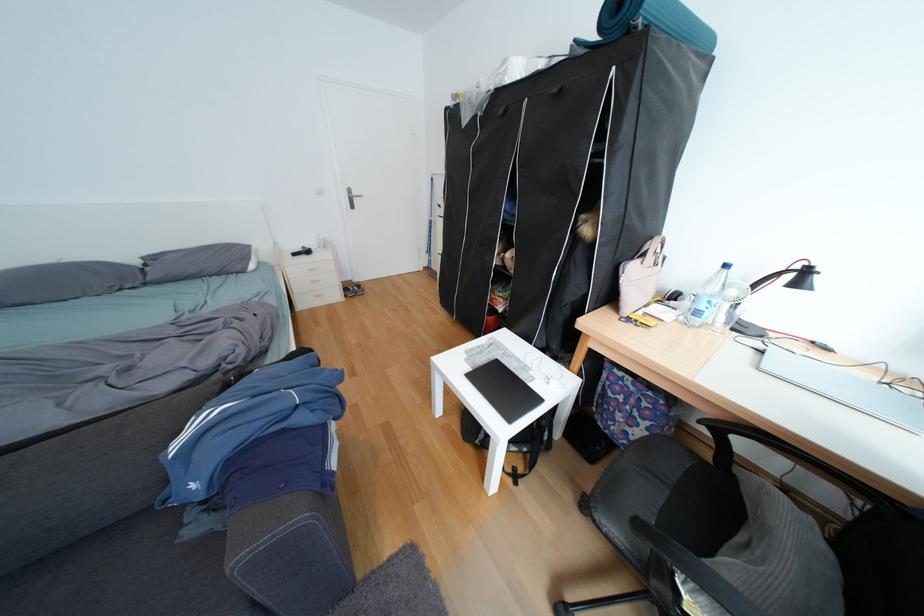
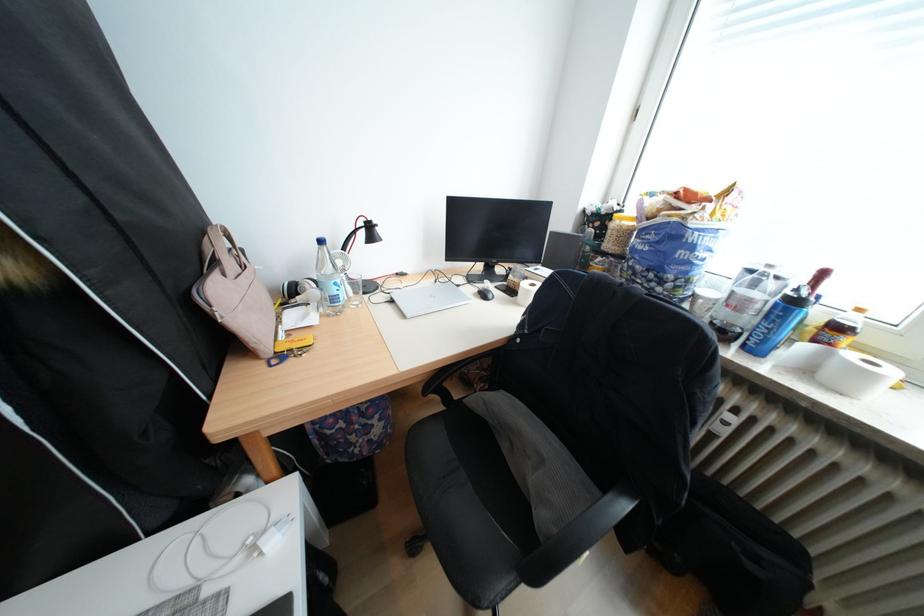
Find the pixel in the second image that matches pixel 803 278 in the first image.

(374, 235)